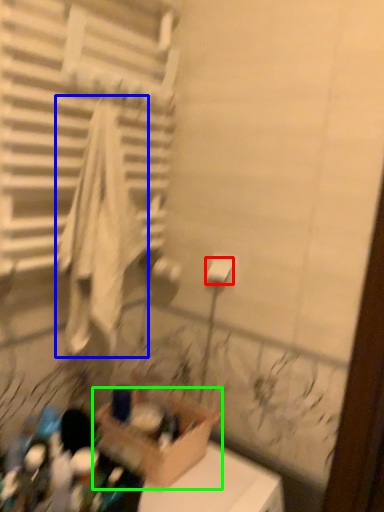
Question: Which object is the closest to the toilet paper (highlighted by a red box)? Choose among these: bath towel (highlighted by a blue box) or cardboard box (highlighted by a green box).

Choices:
 (A) bath towel
 (B) cardboard box

Answer: (A)